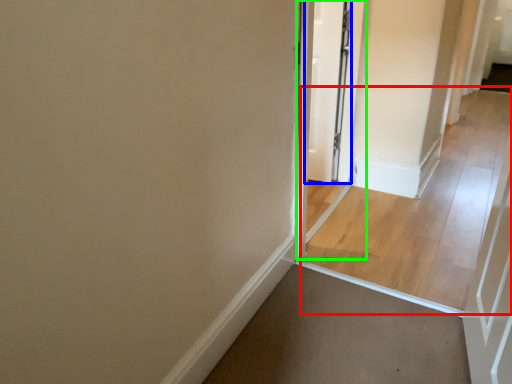
Question: Which is nearer to the path (highlighted by a red box)? door (highlighted by a blue box) or screen door (highlighted by a green box).

Choices:
 (A) door
 (B) screen door

Answer: (B)